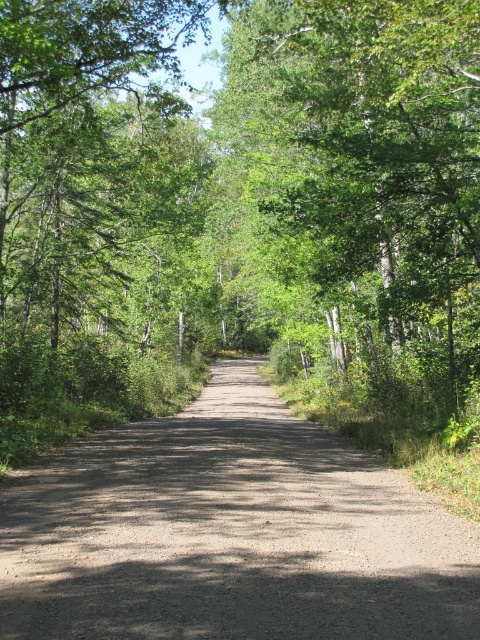
Can you confirm if green leafy tree at center is taller than dirt/gravel road at center?

Yes.

You are a GUI agent. You are given a task and a screenshot of the screen. Output one action in this format:
    pyautogui.click(x=<x>, y=<y>)
    Task: Click on the green leafy tree at center
    
    Given the screenshot: What is the action you would take?
    pyautogui.click(x=247, y=179)

You are a GUI agent. You are given a task and a screenshot of the screen. Output one action in this format:
    pyautogui.click(x=<x>, y=<y>)
    Task: Click on the green leafy tree at center
    This screenshot has width=480, height=640.
    Given the screenshot: What is the action you would take?
    pyautogui.click(x=247, y=179)